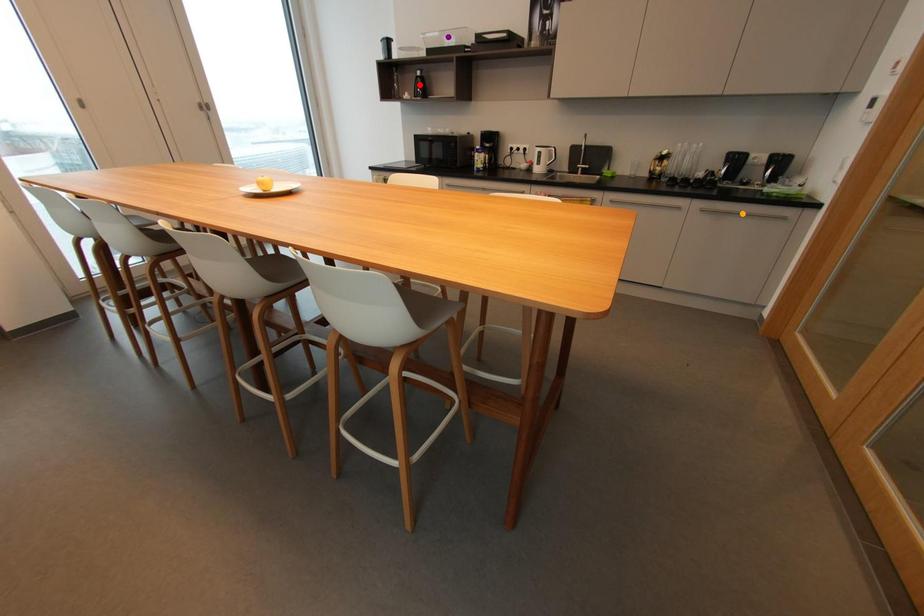
Order these from nearest to farthest:
red point | purple point | orange point

1. red point
2. purple point
3. orange point